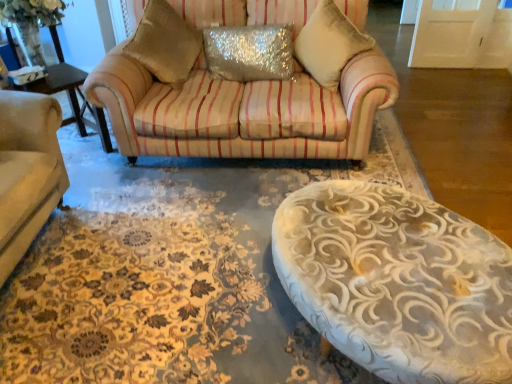
Question: Which direction should I rotate to look at sparkly silver pillow at center, which is the first pillow in left-to-right order?

Choices:
 (A) right
 (B) left

Answer: (B)

Question: Is sparkly silver pillow at center, which appears as the 2th pillow when viewed from the right, in front of velvet beige pillow at upper center, the second pillow positioned from the left?

Choices:
 (A) yes
 (B) no

Answer: (B)

Question: From a real-world perspective, is sparkly silver pillow at center, which appears as the 2th pillow when viewed from the right, located beneath velvet beige pillow at upper center, the second pillow positioned from the left?

Choices:
 (A) no
 (B) yes

Answer: (B)

Question: Considering the relative sizes of sparkly silver pillow at center, which is the first pillow in left-to-right order, and velvet beige pillow at upper center, the second pillow positioned from the left, in the image provided, is sparkly silver pillow at center, which is the first pillow in left-to-right order, smaller than velvet beige pillow at upper center, the second pillow positioned from the left,?

Choices:
 (A) yes
 (B) no

Answer: (A)

Question: Is sparkly silver pillow at center, which is the first pillow in left-to-right order, beside velvet beige pillow at upper center, the 1th pillow when ordered from right to left?

Choices:
 (A) no
 (B) yes

Answer: (A)

Question: Does sparkly silver pillow at center, which appears as the 2th pillow when viewed from the right, have a larger size compared to velvet beige pillow at upper center, the second pillow positioned from the left?

Choices:
 (A) no
 (B) yes

Answer: (A)

Question: Is velvet beige pillow at upper center, the 1th pillow when ordered from right to left, located outside sparkly silver pillow at center, which appears as the 2th pillow when viewed from the right?

Choices:
 (A) no
 (B) yes

Answer: (B)

Question: From the image's perspective, does velvet beige pillow at upper center, the second pillow positioned from the left, appear lower than sparkly silver pillow at center, which is the first pillow in left-to-right order?

Choices:
 (A) yes
 (B) no

Answer: (B)

Question: From a real-world perspective, is velvet beige pillow at upper center, the 1th pillow when ordered from right to left, positioned under sparkly silver pillow at center, which appears as the 2th pillow when viewed from the right, based on gravity?

Choices:
 (A) no
 (B) yes

Answer: (A)

Question: Would you consider velvet beige pillow at upper center, the second pillow positioned from the left, to be distant from sparkly silver pillow at center, which appears as the 2th pillow when viewed from the right?

Choices:
 (A) no
 (B) yes

Answer: (A)

Question: Can you confirm if velvet beige pillow at upper center, the 1th pillow when ordered from right to left, is wider than sparkly silver pillow at center, which appears as the 2th pillow when viewed from the right?

Choices:
 (A) no
 (B) yes

Answer: (B)

Question: Does velvet beige pillow at upper center, the second pillow positioned from the left, have a lesser width compared to sparkly silver pillow at center, which appears as the 2th pillow when viewed from the right?

Choices:
 (A) no
 (B) yes

Answer: (A)

Question: Would you say velvet beige pillow at upper center, the second pillow positioned from the left, is inside or outside sparkly silver pillow at center, which is the first pillow in left-to-right order?

Choices:
 (A) outside
 (B) inside

Answer: (A)